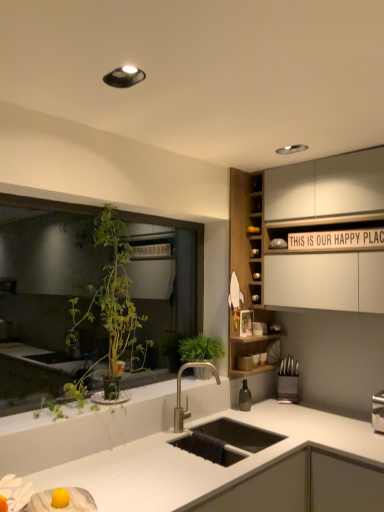
Question: Is wooden cabinet at upper right further to the viewer compared to black plastic knife block at right?

Choices:
 (A) no
 (B) yes

Answer: (A)

Question: Is wooden cabinet at upper right in front of black plastic knife block at right?

Choices:
 (A) yes
 (B) no

Answer: (A)

Question: Can you confirm if wooden cabinet at upper right is thinner than black plastic knife block at right?

Choices:
 (A) yes
 (B) no

Answer: (B)

Question: Can you confirm if wooden cabinet at upper right is smaller than black plastic knife block at right?

Choices:
 (A) no
 (B) yes

Answer: (A)

Question: Is wooden cabinet at upper right to the left of black plastic knife block at right from the viewer's perspective?

Choices:
 (A) no
 (B) yes

Answer: (B)

Question: Is black plastic knife block at right inside the boundaries of wooden cabinet at upper right, or outside?

Choices:
 (A) outside
 (B) inside

Answer: (A)

Question: Considering the relative positions of black plastic knife block at right and wooden cabinet at upper right in the image provided, is black plastic knife block at right to the left or to the right of wooden cabinet at upper right?

Choices:
 (A) left
 (B) right

Answer: (B)

Question: Considering the positions of black plastic knife block at right and wooden cabinet at upper right in the image, is black plastic knife block at right taller or shorter than wooden cabinet at upper right?

Choices:
 (A) tall
 (B) short

Answer: (B)

Question: In the image, is black plastic knife block at right positioned in front of or behind wooden cabinet at upper right?

Choices:
 (A) behind
 (B) front

Answer: (A)

Question: Is green leafy plant at left inside or outside of wooden cabinet at upper right?

Choices:
 (A) outside
 (B) inside

Answer: (A)

Question: Is point (26, 196) positioned closer to the camera than point (254, 181)?

Choices:
 (A) closer
 (B) farther

Answer: (A)

Question: Would you say green leafy plant at left is to the left or to the right of wooden cabinet at upper right in the picture?

Choices:
 (A) right
 (B) left

Answer: (B)

Question: Considering their positions, is green leafy plant at left located in front of or behind wooden cabinet at upper right?

Choices:
 (A) front
 (B) behind

Answer: (A)

Question: Considering the positions of point (201, 365) and point (79, 211), is point (201, 365) closer or farther from the camera than point (79, 211)?

Choices:
 (A) farther
 (B) closer

Answer: (A)

Question: In the image, is satin nickel faucet at center positioned in front of or behind green leafy plant at left?

Choices:
 (A) front
 (B) behind

Answer: (B)